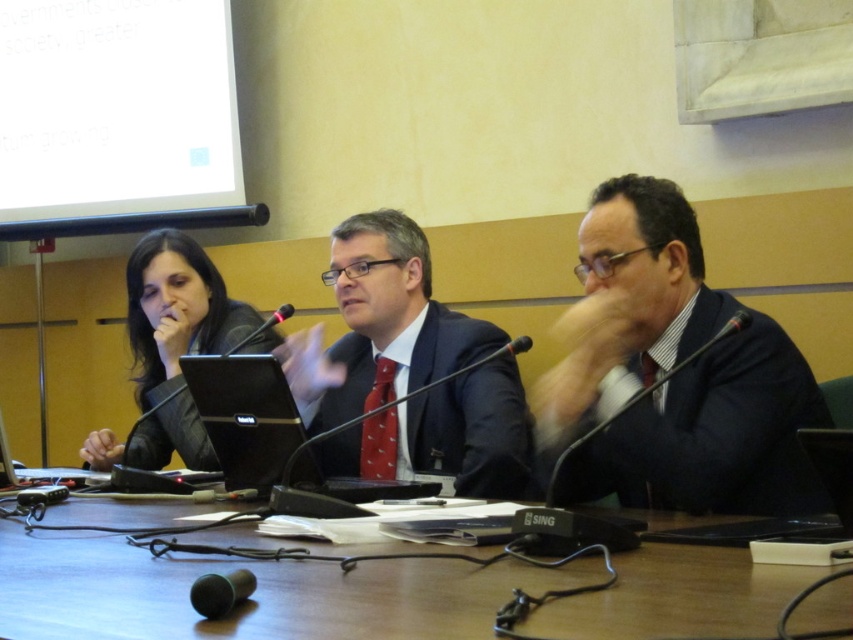
Which is in front, point (254, 374) or point (834, 509)?

Point (834, 509) is in front.

The width and height of the screenshot is (853, 640). What do you see at coordinates (270, 432) in the screenshot?
I see `black plastic laptop at center` at bounding box center [270, 432].

Identify the location of black plastic laptop at center. (270, 432).

The height and width of the screenshot is (640, 853). What are the coordinates of `black fabric jacket at left` in the screenshot? It's located at (177, 310).

Can you confirm if black fabric jacket at left is positioned to the left of silver metallic laptop at center?

In fact, black fabric jacket at left is to the right of silver metallic laptop at center.

Where is `black fabric jacket at left`? This screenshot has height=640, width=853. black fabric jacket at left is located at coordinates (177, 310).

Is wooden table at center positioned at the back of black glossy laptop at center?

No, wooden table at center is closer to the viewer.

Does wooden table at center come in front of black glossy laptop at center?

Yes.

Locate an element on the screen. Image resolution: width=853 pixels, height=640 pixels. wooden table at center is located at coordinates (254, 595).